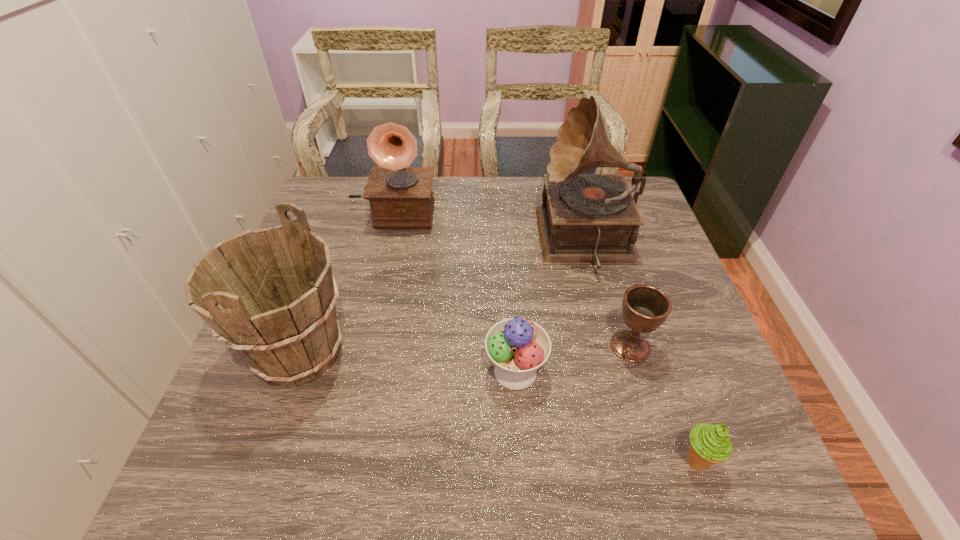
Locate which object ranks fourth in proximity to the chalice. Please provide its 2D coordinates. Your answer should be formatted as a tuple, i.e. [(x, y)], where the tuple contains the x and y coordinates of a point satisfying the conditions above.

[(400, 196)]

Locate an element on the screen. The width and height of the screenshot is (960, 540). free space that satisfies the following two spatial constraints: 1. from the horn of the nearest object; 2. on the left side of the taller record player is located at coordinates coord(643,461).

You are a GUI agent. You are given a task and a screenshot of the screen. Output one action in this format:
    pyautogui.click(x=<x>, y=<y>)
    Task: Click on the vacant space that satisfies the following two spatial constraints: 1. on the horn of the third object from left to right; 2. on the left side of the shorter record player
    
    Given the screenshot: What is the action you would take?
    click(357, 371)

In order to click on free location that satisfies the following two spatial constraints: 1. on the horn of the left record player; 2. on the left side of the fourth object from right to left in this screenshot , I will do `click(357, 371)`.

I want to click on free space that satisfies the following two spatial constraints: 1. from the horn of the right record player; 2. on the front side of the farther icecream, so click(620, 371).